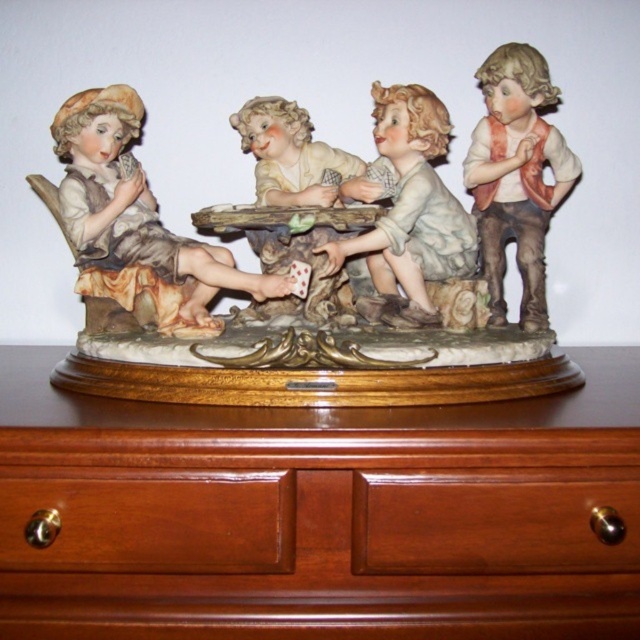
Question: Is brown polished wood drawer at lower left positioned in front of matte white porcelain boy at upper right?

Choices:
 (A) no
 (B) yes

Answer: (B)

Question: Does porcelain figurines at center appear on the right side of porcelain doll at center?

Choices:
 (A) yes
 (B) no

Answer: (B)

Question: Which object is the closest to the porcelain doll at center?

Choices:
 (A) matte white porcelain boy at upper right
 (B) porcelain figurines at center
 (C) wooden table at center

Answer: (C)

Question: Which point is farther to the camera?

Choices:
 (A) (160, 536)
 (B) (180, 310)

Answer: (B)

Question: In this image, where is brown polished wood drawer at lower left located relative to porcelain doll at center?

Choices:
 (A) left
 (B) right

Answer: (A)

Question: Which object is farther from the camera taking this photo?

Choices:
 (A) porcelain figurines at center
 (B) brown wood dresser at center

Answer: (A)